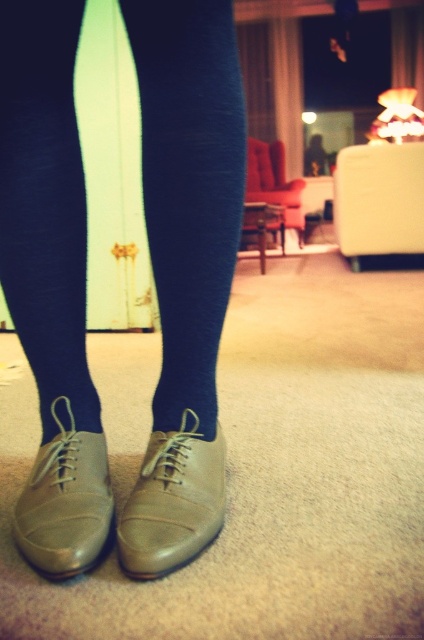
Question: Does blue tights at center have a lesser width compared to matte leather shoe at lower center?

Choices:
 (A) yes
 (B) no

Answer: (B)

Question: Which object is positioned closest to the matte leather shoe at center?

Choices:
 (A) matte leather shoe at lower center
 (B) blue tights at center

Answer: (A)

Question: Which object is closer to the camera taking this photo?

Choices:
 (A) blue tights at center
 (B) matte leather shoe at center
 (C) matte leather shoe at lower center

Answer: (B)

Question: Is blue tights at center thinner than matte leather shoe at lower center?

Choices:
 (A) yes
 (B) no

Answer: (B)

Question: Is blue tights at center to the right of matte leather shoe at lower center from the viewer's perspective?

Choices:
 (A) no
 (B) yes

Answer: (B)

Question: Which of these objects is positioned farthest from the matte leather shoe at center?

Choices:
 (A) blue tights at center
 (B) matte leather shoe at lower center

Answer: (A)